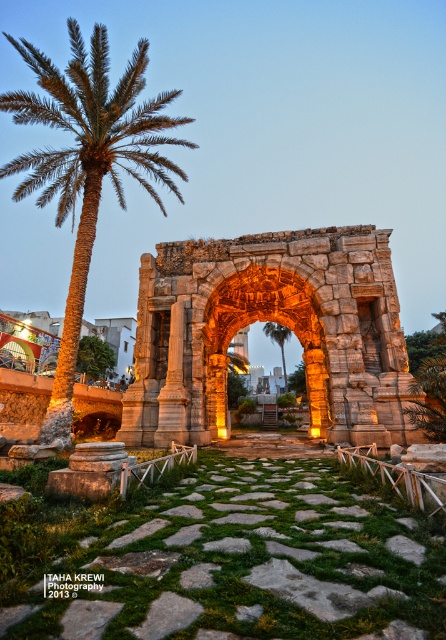
Question: Is stone archway at center smaller than green leafy palm tree at left?

Choices:
 (A) no
 (B) yes

Answer: (A)

Question: Is stone archway at center thinner than green leafy palm tree at left?

Choices:
 (A) no
 (B) yes

Answer: (A)

Question: Which object is the closest to the stone archway at center?

Choices:
 (A) carved stone arch at center
 (B) green leafy palm at left
 (C) green leafy palm tree at left

Answer: (A)

Question: Can you confirm if carved stone arch at center is positioned above green leafy palm at left?

Choices:
 (A) no
 (B) yes

Answer: (A)

Question: Which point is closer to the camera?

Choices:
 (A) green leafy palm at left
 (B) green leafy palm tree at left

Answer: (A)

Question: Which point appears closest to the camera in this image?

Choices:
 (A) (90, 97)
 (B) (284, 330)

Answer: (A)